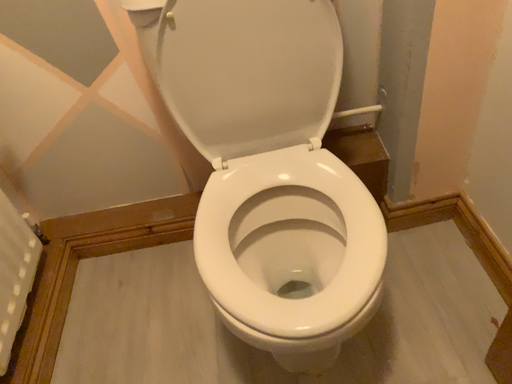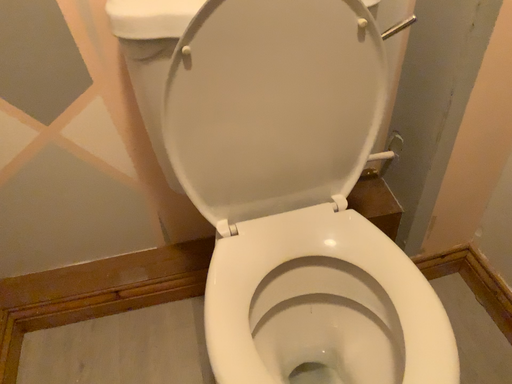
Question: How did the camera likely rotate when shooting the video?

Choices:
 (A) rotated left
 (B) rotated right

Answer: (B)